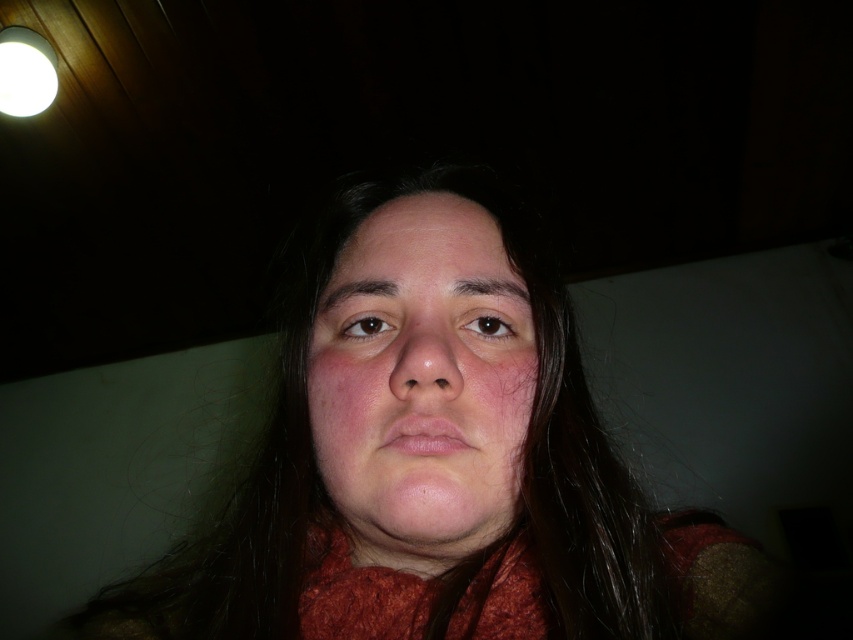
You are standing in a dimly lit room with a ceiling light in the upper left corner. You see a person with long dark hair wearing a red garment. There is a point marked at coordinates (x=434, y=460). What object is located at that point?

The point at coordinates (x=434, y=460) marks the matte orange scarf at center.

You are a photographer adjusting the lighting in the scene. You want to ensure the matte orange scarf at center and the smooth skin face at center are both well lit. Given the ceiling light fixture in the upper left corner, which object should you adjust the light towards to better illuminate both?

The matte orange scarf at center is to the left of the smooth skin face at center. Since the ceiling light fixture is in the upper left corner, adjusting the light towards the scarf would help illuminate both the scarf and the face, as the light would naturally spread from the left towards the center.

You are a photographer adjusting the camera focus. The matte orange scarf at center and the smooth skin face at center are both in the frame. Given that the camera can only focus on one subject at a time, which subject should you choose to ensure the closest object is in focus?

The matte orange scarf at center is closer to the camera than the smooth skin face at center, so you should focus on the matte orange scarf at center to ensure the closest object is in focus.